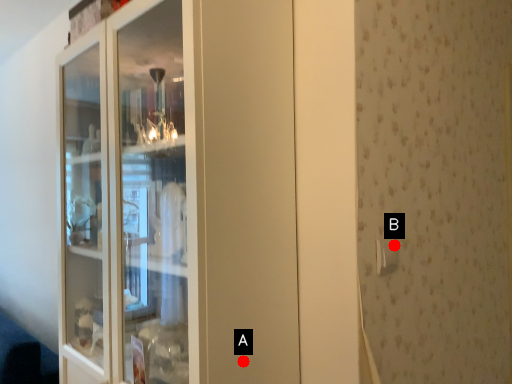
Question: Two points are circled on the image, labeled by A and B beside each circle. Which point is closer to the camera taking this photo?

Choices:
 (A) A is closer
 (B) B is closer

Answer: (A)